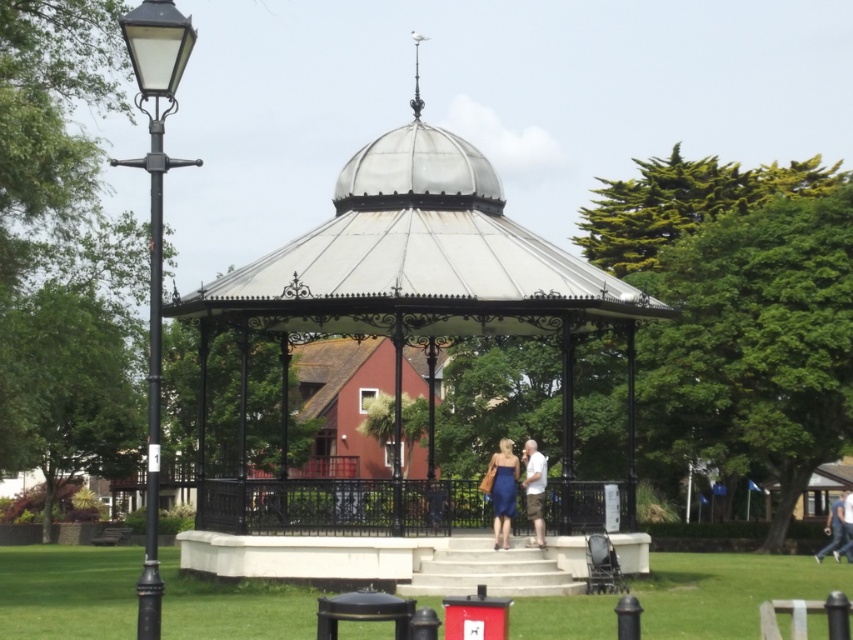
Question: In this image, where is polished metal gazebo at center located relative to black metal/texture lamp post at left?

Choices:
 (A) right
 (B) left

Answer: (A)

Question: Among these points, which one is nearest to the camera?

Choices:
 (A) (165, 8)
 (B) (840, 516)
 (C) (503, 451)

Answer: (A)

Question: Is polished metal gazebo at center bigger than light blue jeans at lower right?

Choices:
 (A) yes
 (B) no

Answer: (A)

Question: Which point is farther to the camera?

Choices:
 (A) light brown leather jacket at lower center
 (B) polished metal gazebo at center
 (C) black metal/texture lamp post at left
 (D) light blue jeans at lower right

Answer: (D)

Question: Among these points, which one is nearest to the camera?

Choices:
 (A) (529, 442)
 (B) (177, 106)
 (C) (157, 164)
 (D) (419, 275)

Answer: (C)

Question: Considering the relative positions of polished metal gazebo at center and black metal/texture lamp post at left in the image provided, where is polished metal gazebo at center located with respect to black metal/texture lamp post at left?

Choices:
 (A) left
 (B) right

Answer: (B)